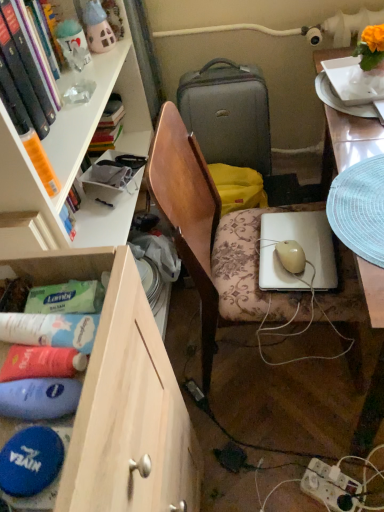
Question: Considering the relative positions of wooden chair at center and wooden drawer at lower left in the image provided, is wooden chair at center to the left or to the right of wooden drawer at lower left?

Choices:
 (A) left
 (B) right

Answer: (B)

Question: From a real-world perspective, is wooden chair at center physically located above or below wooden drawer at lower left?

Choices:
 (A) above
 (B) below

Answer: (B)

Question: Which of these objects is positioned farthest from the white glossy desk at right?

Choices:
 (A) white glossy plate at upper right
 (B) wooden chair at center
 (C) matte gray suitcase at center
 (D) hardcover book at upper left
 (E) wooden drawer at lower left

Answer: (D)

Question: Which of these objects is positioned farthest from the white glossy desk at right?

Choices:
 (A) wooden drawer at lower left
 (B) white glossy plate at upper right
 (C) white plastic power outlet at lower right
 (D) matte gray suitcase at center
 (E) hardcover book at upper left

Answer: (C)